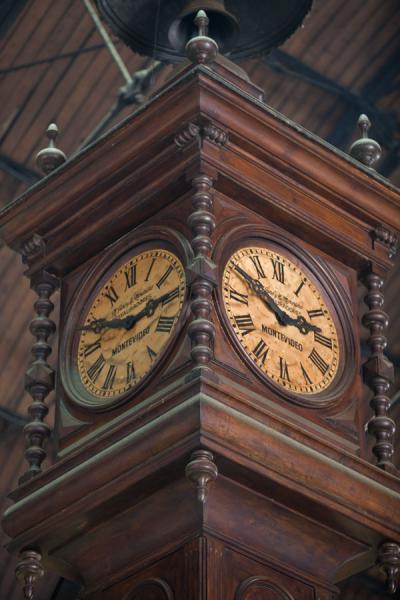
I want to click on wood frame, so click(x=96, y=478), click(x=312, y=468), click(x=280, y=530), click(x=133, y=548), click(x=96, y=159), click(x=329, y=166), click(x=289, y=201), click(x=96, y=227).